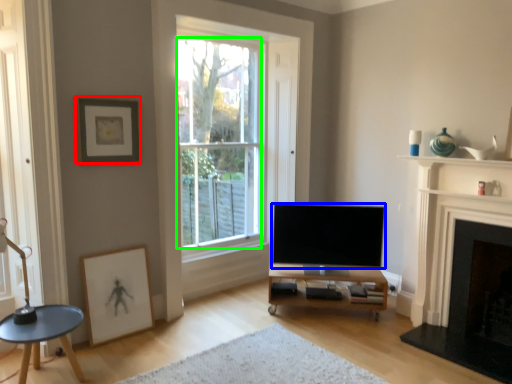
Question: Based on their relative distances, which object is nearer to picture frame (highlighted by a red box)? Choose from television (highlighted by a blue box) and window (highlighted by a green box).

Choices:
 (A) television
 (B) window

Answer: (A)